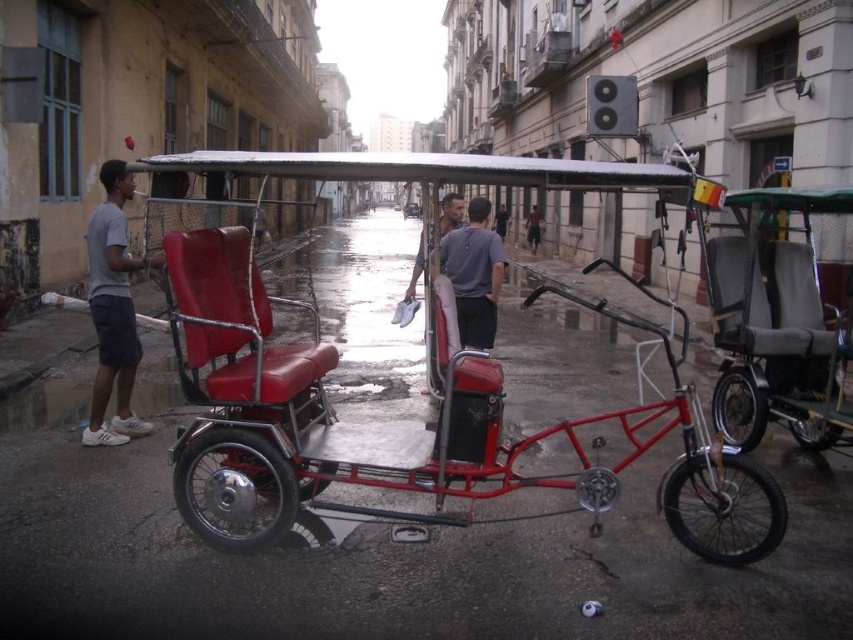
You are a tourist in Cuba and want to take a photo of the two men. You notice the gray fabric shorts at left and the matte gray shirt at center. Which clothing item is positioned higher in the image?

The gray fabric shorts at left is taller than matte gray shirt at center, so the gray fabric shorts at left is positioned higher in the image.

You are a tourist in Cuba and want to take a ride to the beach. You see a metallic red tricycle at center and a gray fabric cart at right. Which vehicle is closer to you?

The metallic red tricycle at center is closer to you since it is located below the gray fabric cart at right, indicating it is positioned lower and thus nearer in the scene.

In the scene shown: You are a tourist in Cuba and want to take a ride to the beach. You see a metallic red tricycle at center and a gray fabric cart at right. Which one is closer to the beach if you are facing the scene?

The metallic red tricycle at center is positioned on the left side of gray fabric cart at right. Since you are facing the scene, the left side would be closer to the beach direction, so the metallic red tricycle at center is closer to the beach.